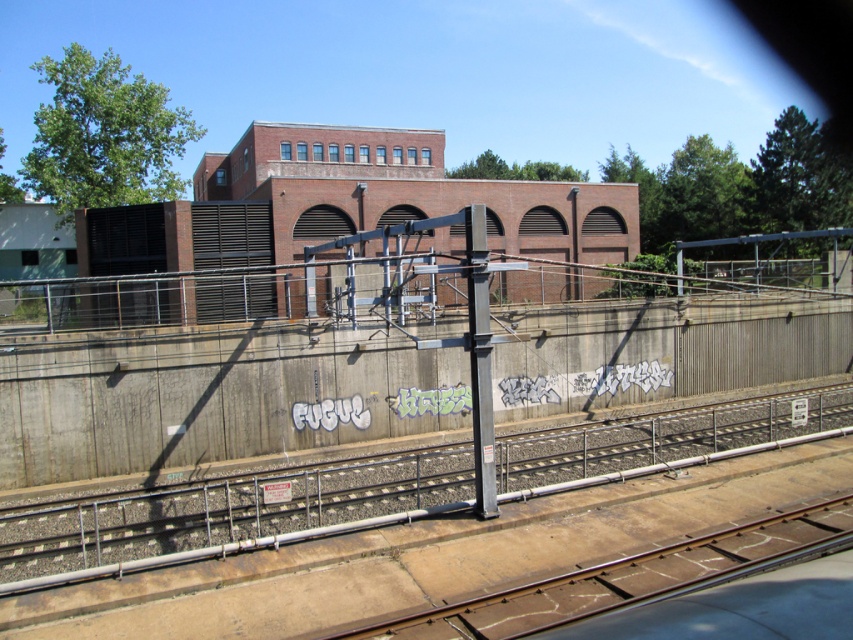
From the picture: You are standing on the railway track and looking towards the red brick building. There are two points marked on the wall with graffiti. The first point is at coordinate point (403,474) and the second point is at point (845,500). Which point is closer to you?

Point (403,474) is closer to you because it is further to the viewer than point (845,500).

You are a city planner assessing the railway infrastructure. You notice two tracks in the scene. Which track, the concrete train track at center or the brown metal train track at lower center, has a greater width?

The concrete train track at center is larger in size than the brown metal train track at lower center, so the concrete train track at center has a greater width.

You are a pedestrian standing on the sidewalk next to the concrete train track at center and the brown metal train track at lower center. Which track is closer to the sidewalk?

The brown metal train track at lower center is closer to the sidewalk because the concrete train track at center is to the right of it, meaning the brown metal train track is positioned between the sidewalk and the concrete track.